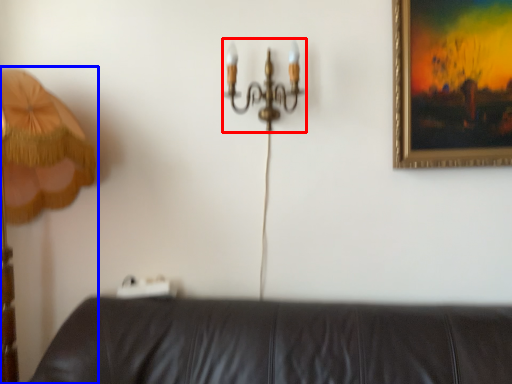
Question: Which object is further to the camera taking this photo, chandelier (highlighted by a red box) or lamp (highlighted by a blue box)?

Choices:
 (A) chandelier
 (B) lamp

Answer: (A)